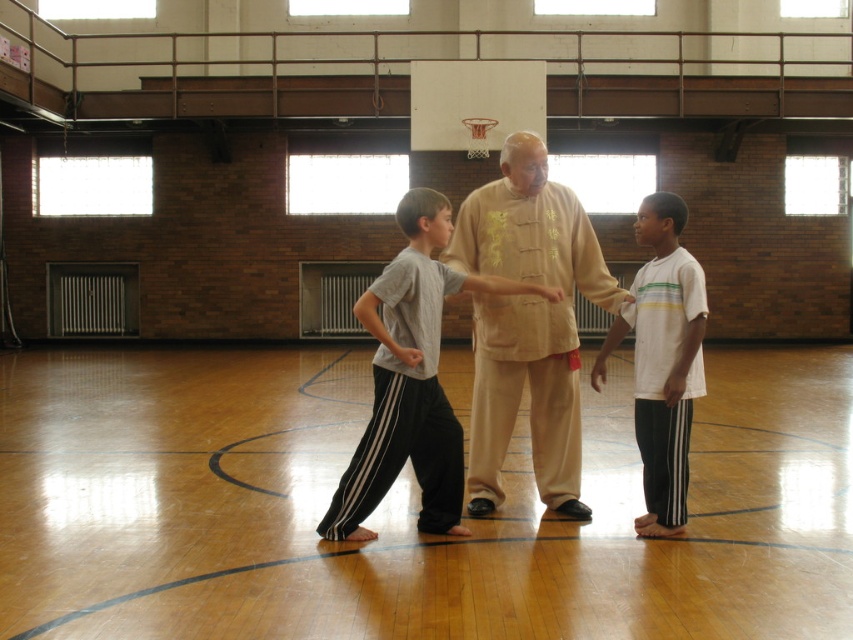
Where is `beige cotton pants at center`? The image size is (853, 640). beige cotton pants at center is located at coordinates (527, 323).

Between beige cotton pants at center and gray cotton shirt at center, which one has less height?

With less height is gray cotton shirt at center.

Which is in front, point (492, 385) or point (381, 429)?

Point (381, 429) is in front.

You are a GUI agent. You are given a task and a screenshot of the screen. Output one action in this format:
    pyautogui.click(x=<x>, y=<y>)
    Task: Click on the beige cotton pants at center
    This screenshot has height=640, width=853.
    Given the screenshot: What is the action you would take?
    pyautogui.click(x=527, y=323)

Between point (405, 525) and point (660, 301), which one is positioned in front?

Point (660, 301) is in front.

From the picture: Can you confirm if wooden floor at center is positioned to the left of white cotton shirt at center?

Indeed, wooden floor at center is positioned on the left side of white cotton shirt at center.

What do you see at coordinates (403, 508) in the screenshot? The width and height of the screenshot is (853, 640). I see `wooden floor at center` at bounding box center [403, 508].

The width and height of the screenshot is (853, 640). In order to click on wooden floor at center in this screenshot , I will do `click(403, 508)`.

Who is positioned more to the right, wooden floor at center or beige cotton pants at center?

beige cotton pants at center is more to the right.

Is wooden floor at center taller than beige cotton pants at center?

In fact, wooden floor at center may be shorter than beige cotton pants at center.

Is point (718, 548) positioned behind point (598, 264)?

That is False.

Where is `wooden floor at center`? wooden floor at center is located at coordinates (403, 508).